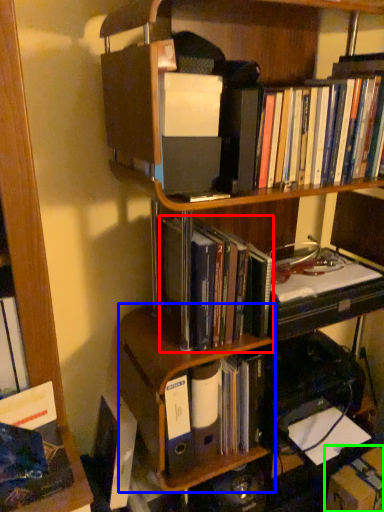
Question: Considering the real-world distances, which object is closest to book (highlighted by a red box)? shelf (highlighted by a blue box) or cardboard box (highlighted by a green box).

Choices:
 (A) shelf
 (B) cardboard box

Answer: (A)